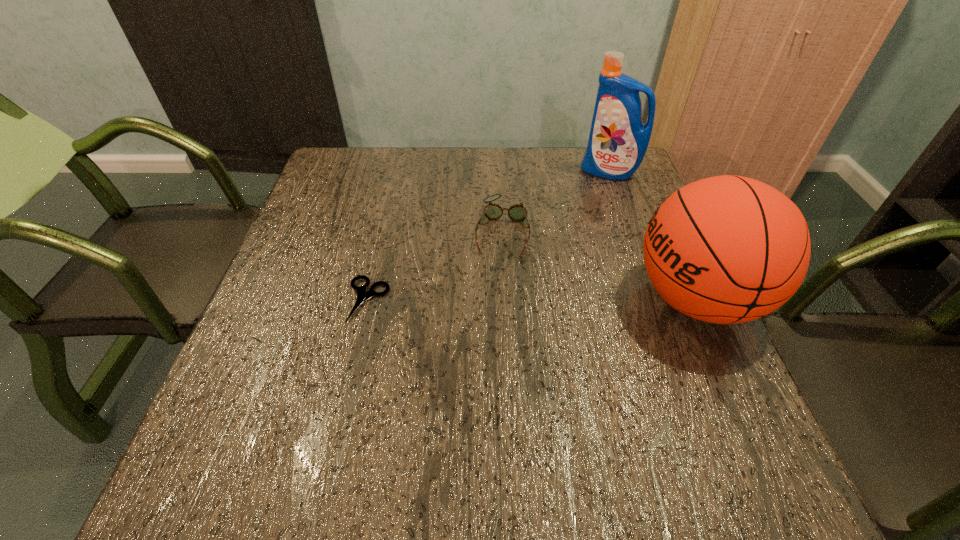
You are a GUI agent. You are given a task and a screenshot of the screen. Output one action in this format:
    pyautogui.click(x=<x>, y=<y>)
    Task: Click on the free space at the far edge of the desktop
    This screenshot has height=540, width=960.
    Given the screenshot: What is the action you would take?
    tap(441, 151)

Image resolution: width=960 pixels, height=540 pixels. I want to click on free space at the near edge of the desktop, so pos(619,430).

The image size is (960, 540). Identify the location of vacant space at the left edge. (276, 320).

At what (x,y) coordinates should I click in order to perform the action: click on vacant area at the right edge of the desktop. Please return your answer as a coordinate pair (x, y). Looking at the image, I should click on (622, 213).

You are a GUI agent. You are given a task and a screenshot of the screen. Output one action in this format:
    pyautogui.click(x=<x>, y=<y>)
    Task: Click on the vacant region at the far left corner
    The width and height of the screenshot is (960, 540).
    Given the screenshot: What is the action you would take?
    pyautogui.click(x=374, y=185)

The width and height of the screenshot is (960, 540). Identify the location of free space at the far right corner of the desktop. (577, 158).

At what (x,y) coordinates should I click in order to perform the action: click on vacant point at the near right corner. Please return your answer as a coordinate pair (x, y). The image size is (960, 540). Looking at the image, I should click on (712, 427).

You are a GUI agent. You are given a task and a screenshot of the screen. Output one action in this format:
    pyautogui.click(x=<x>, y=<y>)
    Task: Click on the empty space between the leftmost object and the spectacles
    This screenshot has width=960, height=540.
    Given the screenshot: What is the action you would take?
    pyautogui.click(x=435, y=266)

Find the location of a particular element. This screenshot has width=960, height=540. free spot between the second object from left to right and the leftmost object is located at coordinates (435, 266).

Identify the location of empty space between the basketball and the third object from right to left. (599, 265).